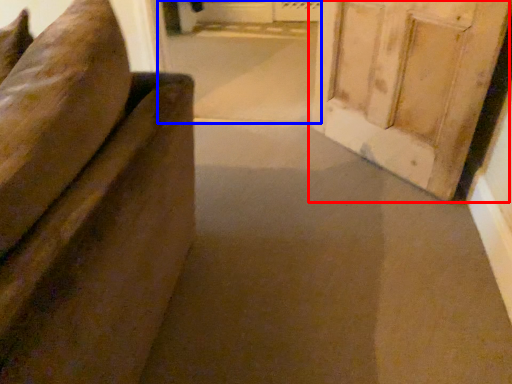
Question: Which object is further to the camera taking this photo, door (highlighted by a red box) or passage (highlighted by a blue box)?

Choices:
 (A) door
 (B) passage

Answer: (B)